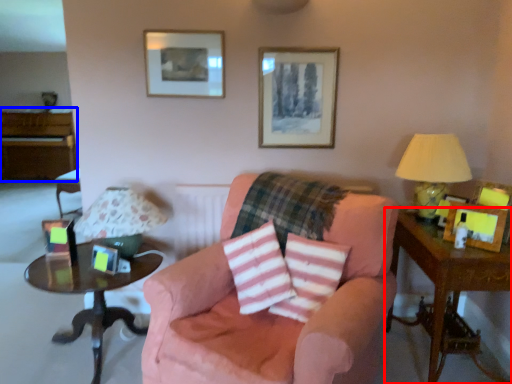
Question: Which object is further to the camera taking this photo, table (highlighted by a red box) or dresser (highlighted by a blue box)?

Choices:
 (A) table
 (B) dresser

Answer: (B)